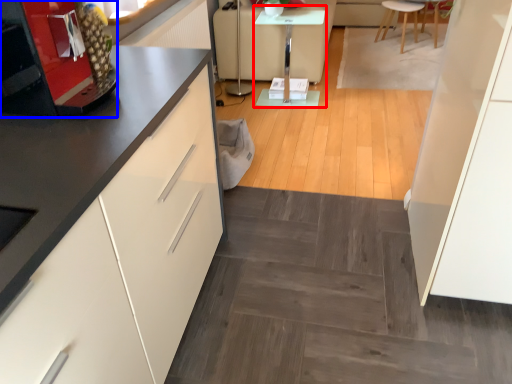
Question: Which object appears closest to the camera in this image, table (highlighted by a red box) or appliance (highlighted by a blue box)?

Choices:
 (A) table
 (B) appliance

Answer: (B)